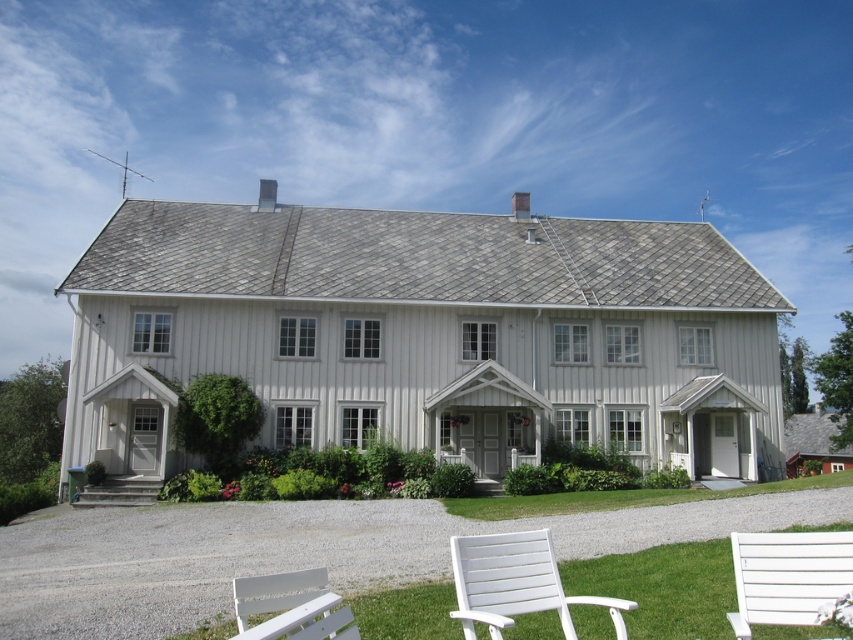
You are standing at the entrance of the house and want to sit down on the white plastic chair at lower center. What are the coordinates of the chair relative to your position?

The white plastic chair at lower center is located at coordinates point (x=515, y=582) relative to your position at the entrance.

You are standing on the lawn and want to sit down. Which object, the white plastic chair at lower center or the white wooden bench at lower right, is closer to you?

The white plastic chair at lower center is closer to you than the white wooden bench at lower right.

You are standing on the gravel driveway and want to sit down on one of the chairs while facing the house. Which direction should you walk from the gray concrete steps at lower left to reach the white wood chairs at lower center?

You should walk to the right from the gray concrete steps at lower left to reach the white wood chairs at lower center since the white wood chairs at lower center is located to the right of the steps.